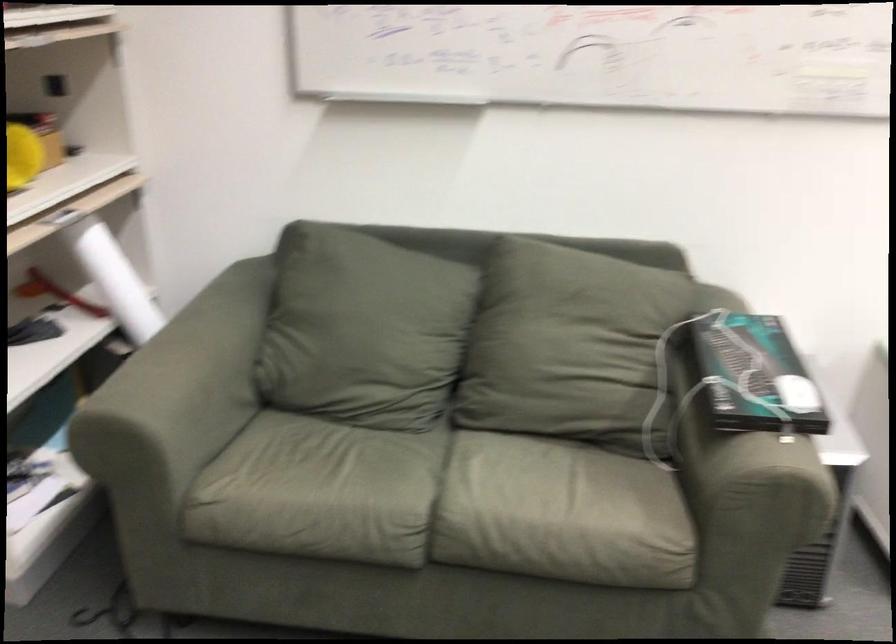
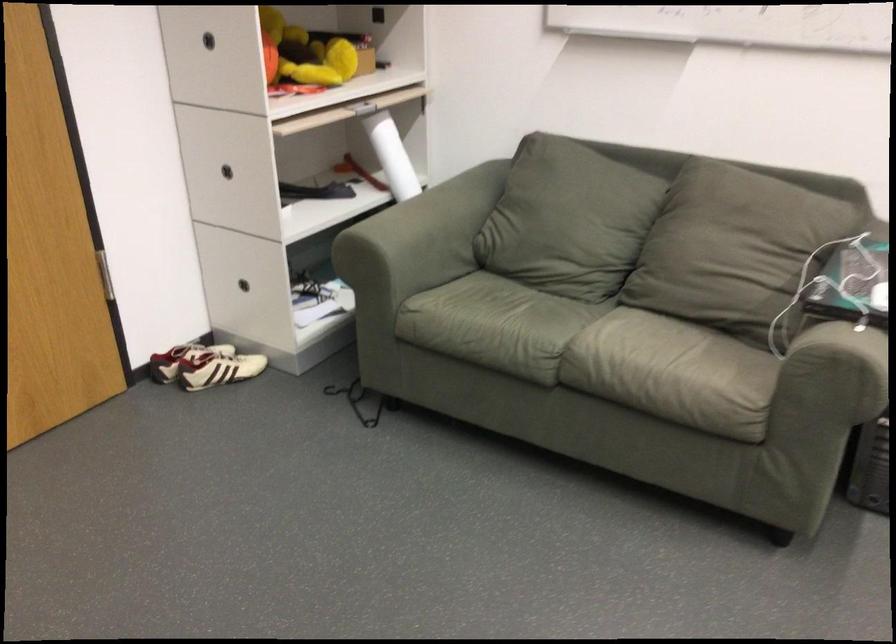
Locate, in the second image, the point that corresponds to [736,377] in the first image.

(851, 279)